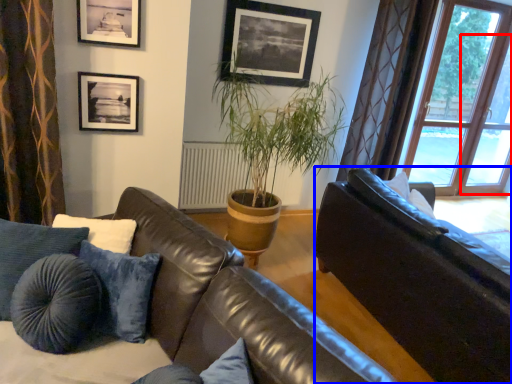
Question: Which object appears closest to the camera in this image, screen door (highlighted by a red box) or studio couch (highlighted by a blue box)?

Choices:
 (A) screen door
 (B) studio couch

Answer: (B)